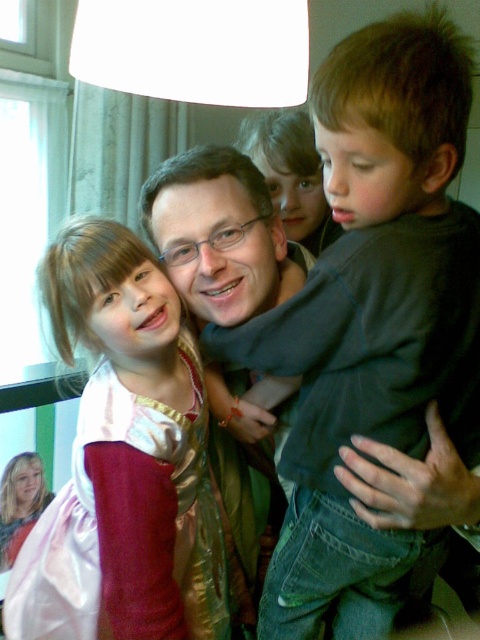
Between point (184, 376) and point (263, 572), which one is positioned behind?

Positioned behind is point (263, 572).

Who is more distant from viewer, (93,504) or (267,232)?

The point (267,232) is more distant.

Locate an element on the screen. The width and height of the screenshot is (480, 640). pink satin dress at center is located at coordinates pos(123,461).

Who is positioned more to the left, dark green shirt at center or pink satin dress at center?

pink satin dress at center

Identify the location of dark green shirt at center. (372, 317).

Identify the location of dark green shirt at center. (372, 317).